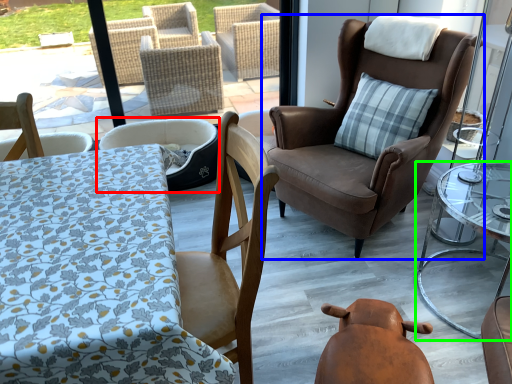
Question: Considering the real-world distances, which object is farthest from chair (highlighted by a red box)? chair (highlighted by a blue box) or table (highlighted by a green box)?

Choices:
 (A) chair
 (B) table

Answer: (B)